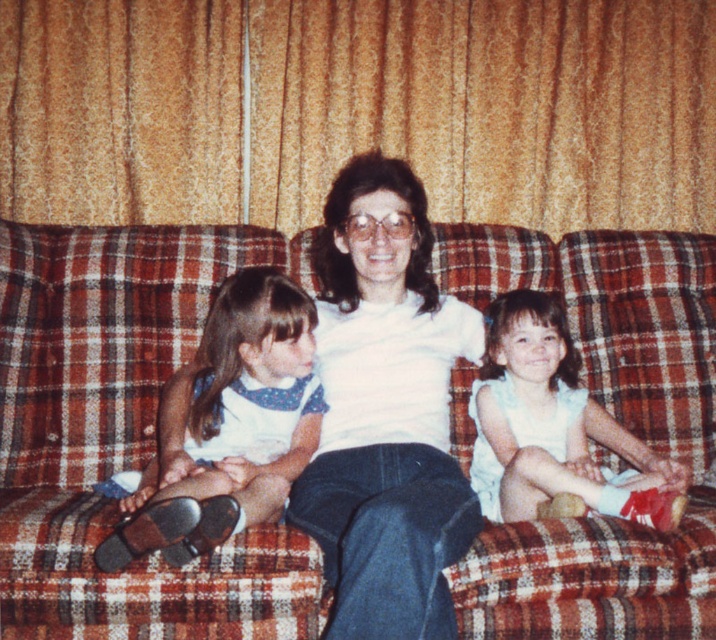
You are standing in front of the couch with the three people. You want to place a small gift exactly at the point marked as point (135, 461). If you are currently 10 feet away from the couch, how many more feet do you need to walk forward to reach that point?

The point (135, 461) is 6.53 feet away from the camera. Since you are currently 10 feet away from the couch, you need to walk forward 10 feet minus 6.53 feet equals 3.47 feet more to reach the point.

Based on the scene description, where is the plaid fabric couch at center located in terms of coordinates?

The plaid fabric couch at center is located at coordinates point (120, 433).

You are a photographer setting up a camera to take a group photo of the scene. You need to ensure that the white matte shirt at center and the white satin dress at center are both clearly visible. Which clothing item should you adjust the camera focus on first to ensure clarity, considering their sizes?

The white matte shirt at center is larger in size than the white satin dress at center, so you should adjust the camera focus on the white matte shirt at center first to ensure clarity.